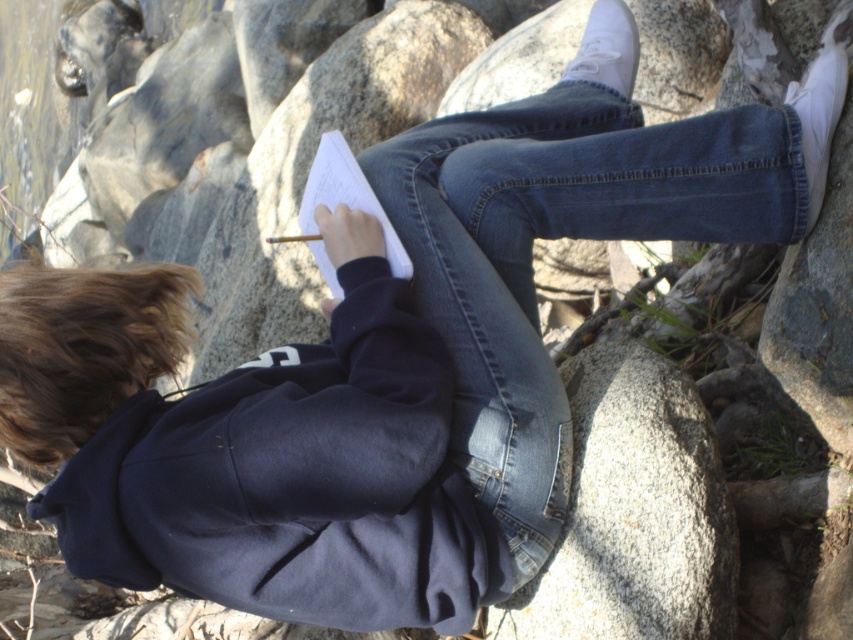
Which is more to the right, denim at center or white paper at center?

From the viewer's perspective, denim at center appears more on the right side.

Between denim at center and white paper at center, which one is positioned higher?

denim at center

Between point (450, 177) and point (311, 209), which one is positioned behind?

The point (311, 209) is more distant.

Locate an element on the screen. denim at center is located at coordinates (558, 237).

Does denim at center lie in front of brown fuzzy hair at upper left?

No, it is not.

Does denim at center have a larger size compared to brown fuzzy hair at upper left?

Correct, denim at center is larger in size than brown fuzzy hair at upper left.

Who is more forward, [491,253] or [77,273]?

Positioned in front is point [77,273].

You are a GUI agent. You are given a task and a screenshot of the screen. Output one action in this format:
    pyautogui.click(x=<x>, y=<y>)
    Task: Click on the denim at center
    This screenshot has height=640, width=853.
    Given the screenshot: What is the action you would take?
    pyautogui.click(x=558, y=237)

Which is below, brown fuzzy hair at upper left or white paper at center?

Positioned lower is brown fuzzy hair at upper left.

Is brown fuzzy hair at upper left positioned at the back of white paper at center?

No, it is not.

Image resolution: width=853 pixels, height=640 pixels. Describe the element at coordinates (82, 348) in the screenshot. I see `brown fuzzy hair at upper left` at that location.

Locate an element on the screen. brown fuzzy hair at upper left is located at coordinates (82, 348).